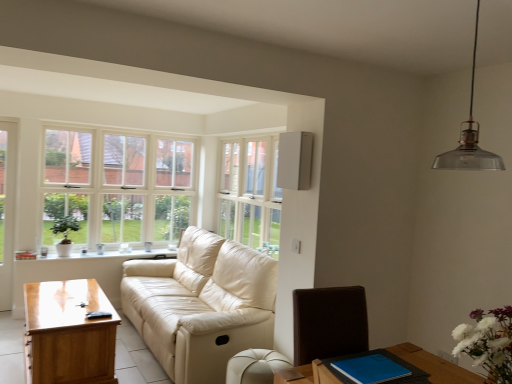
Question: Looking at their shapes, would you say white ceramic window sill at lower left is wider or thinner than transparent glass pendant lamp at upper right?

Choices:
 (A) wide
 (B) thin

Answer: (A)

Question: Is white ceramic window sill at lower left to the left or to the right of transparent glass pendant lamp at upper right in the image?

Choices:
 (A) left
 (B) right

Answer: (A)

Question: Estimate the real-world distances between objects in this image. Which object is farther from the blue leather book at lower right, the first table from the top?

Choices:
 (A) white ceramic window sill at lower left
 (B) white wooden window at upper left, the 2th window positioned from the right
 (C) white matte flowers at lower right
 (D) white wooden window at upper center, which is counted as the first window, starting from the right
 (E) white glass screen door at left

Answer: (E)

Question: Which of these objects is positioned farthest from the white matte flowers at lower right?

Choices:
 (A) transparent glass pendant lamp at upper right
 (B) light brown wooden table at lower left, which appears as the 1th table when ordered from the bottom
 (C) beige leather couch at center
 (D) white glass screen door at left
 (E) blue leather book at lower right, the first table positioned from the right

Answer: (D)